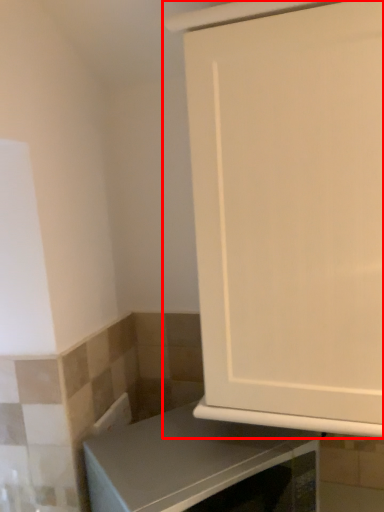
Question: From the image's perspective, what is the correct spatial positioning of cabinetry (annotated by the red box) in reference to countertop?

Choices:
 (A) above
 (B) below

Answer: (A)